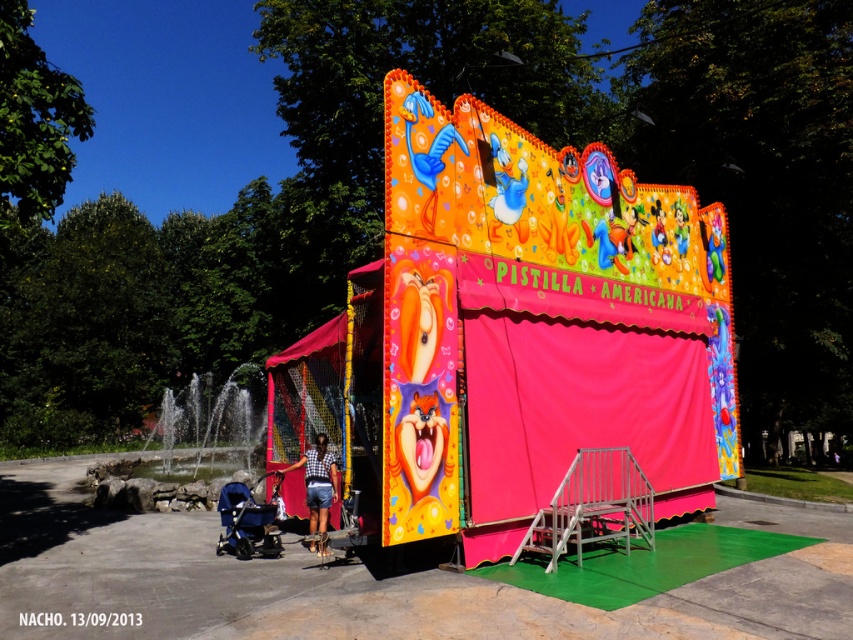
You are standing at the point marked by the coordinates point (408, 140) in the carnival game booth named Pistilla Americana. You want to throw a ball to hit a target located at the entrance of the booth. Considering the distance between you and the entrance, can you estimate if the throw is feasible for an average adult?

The distance between you and the entrance is 7.45 meters. An average adult can throw a ball up to around 15 meters, so the throw is feasible.

You are a parent holding a child and want to enter the vibrant plastic carnival booth at center. Your matte black stroller at lower left is blocking the entrance. Can you move the stroller to the side to access the booth?

The vibrant plastic carnival booth at center is to the right of the matte black stroller at lower left, so you can move the matte black stroller at lower left to the left side to access the booth.